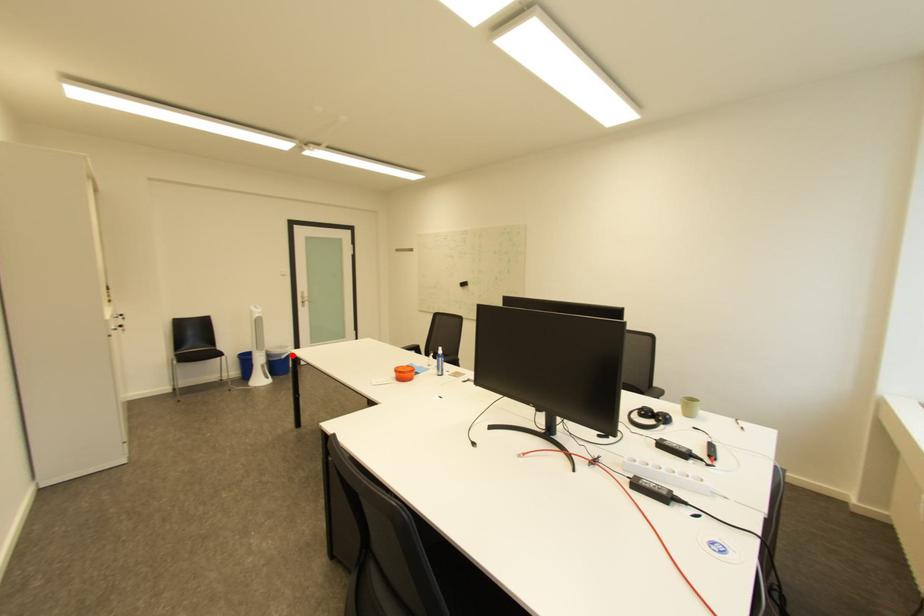
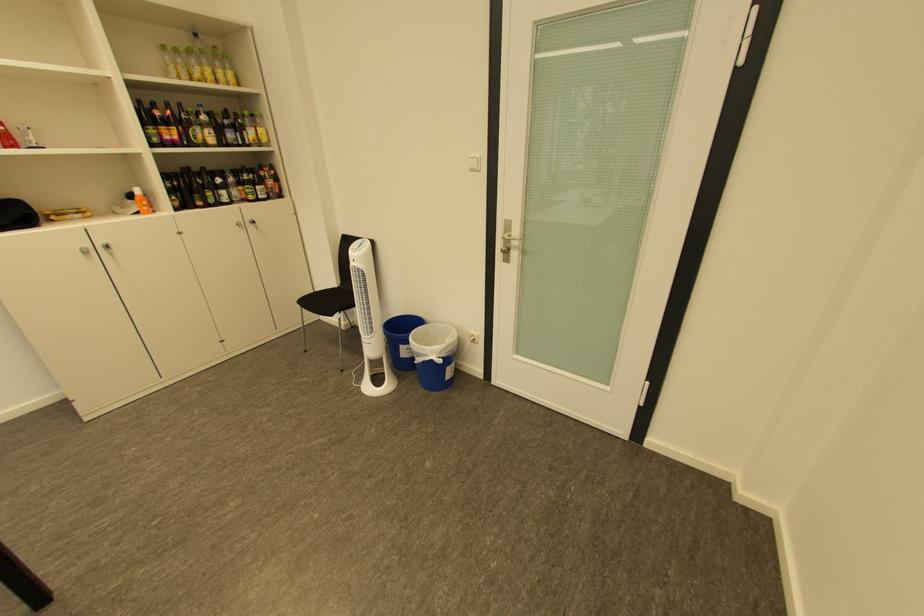
Find the pixel in the second image that matches the highlighted location in the first image.

(429, 355)